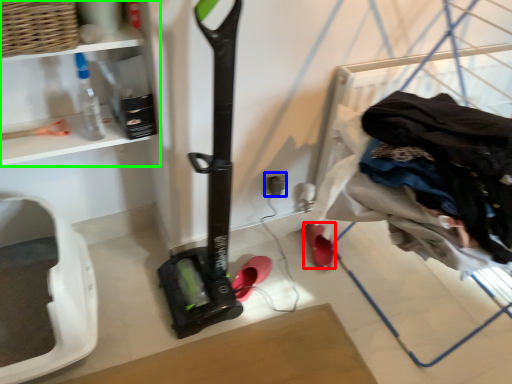
Question: Which is nearer to the footwear (highlighted by a red box)? electric outlet (highlighted by a blue box) or shelf (highlighted by a green box).

Choices:
 (A) electric outlet
 (B) shelf

Answer: (A)